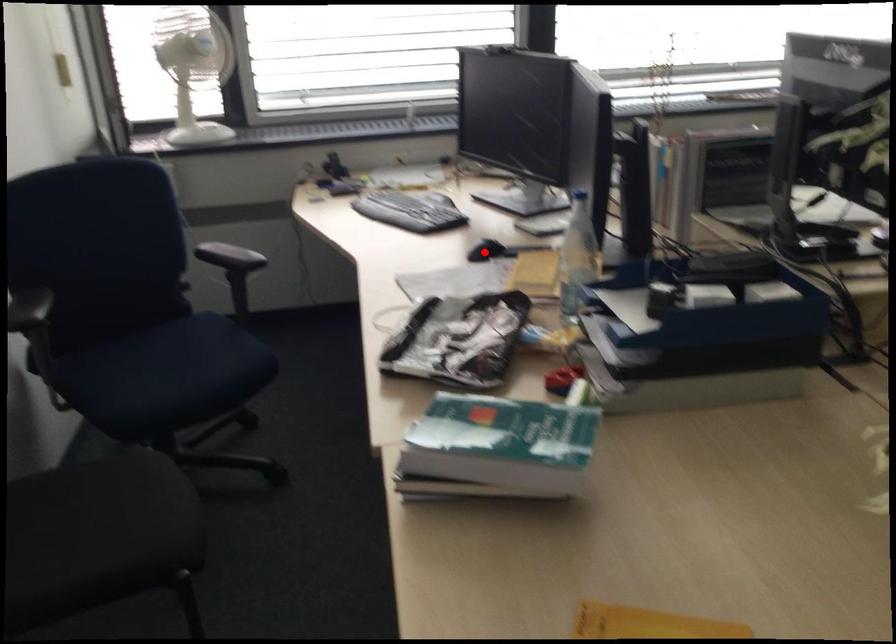
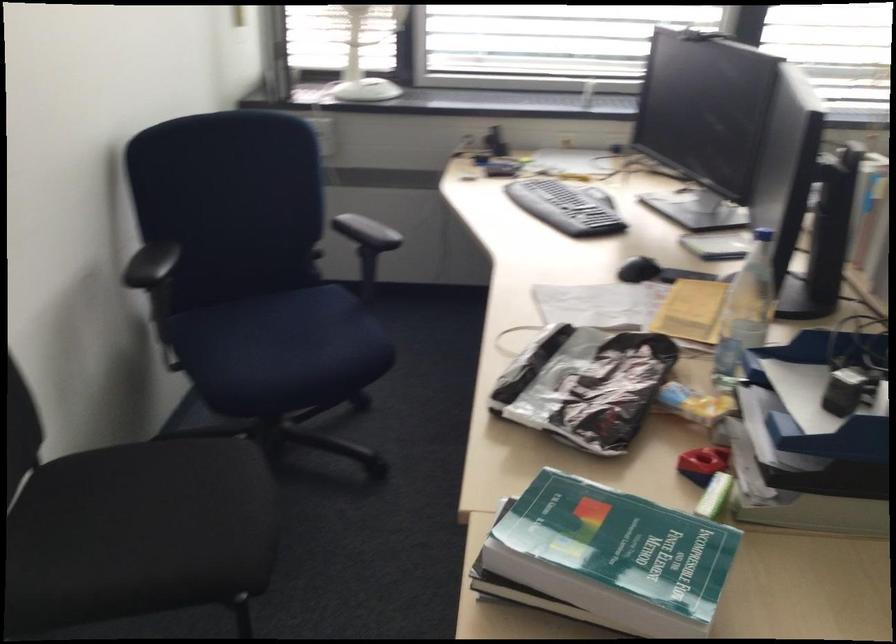
Question: I am providing you with two images of the same scene from different viewpoints. Given a red point in image1, look at the same physical point in image2. Is it:

Choices:
 (A) Closer to the viewpoint
 (B) Farther from the viewpoint

Answer: (A)